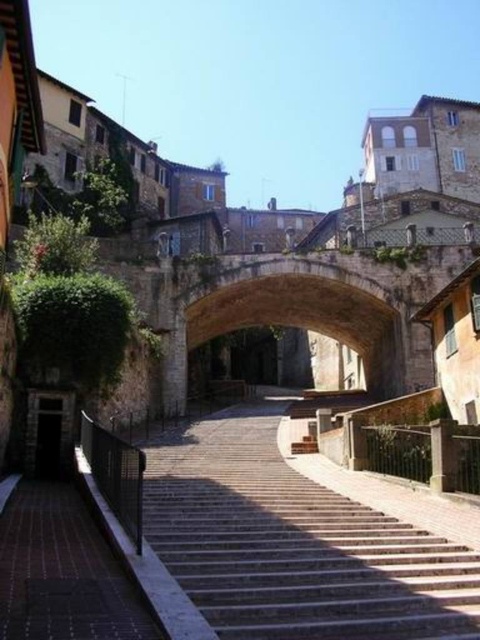
You are standing at the base of the staircase in the urban scene. You want to walk up the stairs to reach the bridge. According to the coordinates provided, where exactly are the smooth stone stairs located in relation to the point marked at coordinates point (294, 545)?

The point (294, 545) corresponds exactly to the location of the smooth stone stairs at center, so they are located precisely at that coordinate.

Consider the image. You are a tourist standing at the bottom of the smooth stone stairs at center, looking up towards the brown stone archway at center. Which object is directly above the other?

The brown stone archway at center is directly above the smooth stone stairs at center.

You are an architect analyzing the layout of this historic town square. You need to determine which of the two structures, the smooth stone stairs at center or the brown stone archway at center, takes up more space in the scene. Based on the image, which one is larger in size?

The brown stone archway at center occupies more space than the smooth stone stairs at center, so the brown stone archway at center is the larger structure in the scene.